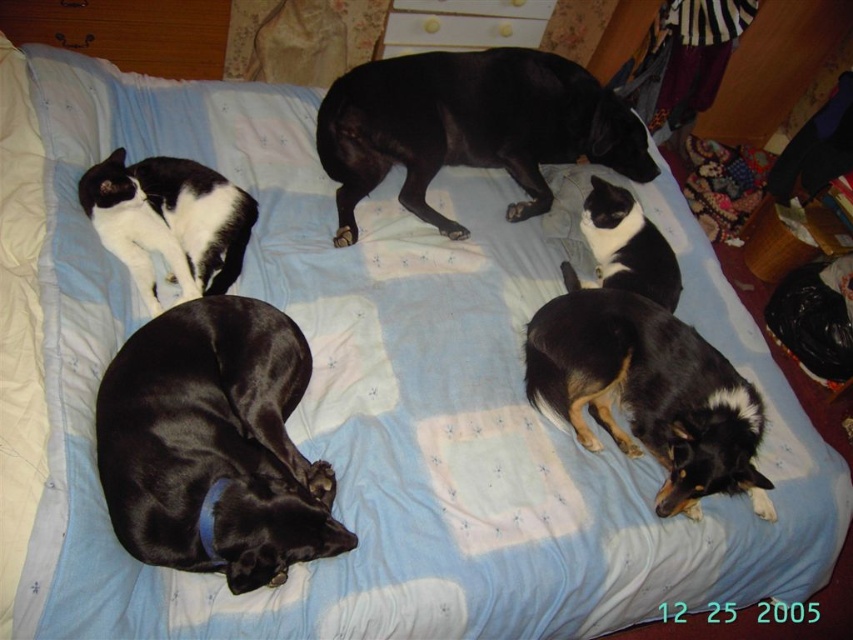
Question: Which point is closer to the camera taking this photo?

Choices:
 (A) (648, 240)
 (B) (573, 88)
 (C) (171, 163)

Answer: (C)

Question: Which point is farther to the camera?

Choices:
 (A) black and white fur cat at upper left
 (B) black and white fur cat at center

Answer: (B)

Question: Which point is farther to the camera?

Choices:
 (A) shiny black dog at lower left
 (B) black and white fur cat at center
 (C) black and tan fur dog at center
 (D) black and white fur cat at upper left

Answer: (B)

Question: Can you confirm if shiny black dog at lower left is thinner than black smooth dog at upper center?

Choices:
 (A) no
 (B) yes

Answer: (B)

Question: Is shiny black dog at lower left positioned in front of black smooth dog at upper center?

Choices:
 (A) yes
 (B) no

Answer: (A)

Question: Can you confirm if shiny black dog at lower left is positioned to the right of black and tan fur dog at center?

Choices:
 (A) yes
 (B) no

Answer: (B)